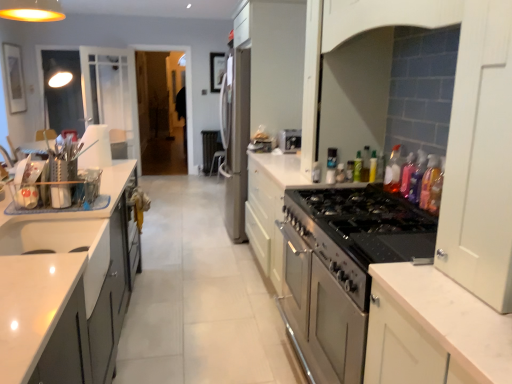
Question: Which direction should I rotate to face satin silver toaster at center, positioned as the second appliance in back-to-front order, — up or down?

Choices:
 (A) down
 (B) up

Answer: (B)

Question: From the image's perspective, would you say satin silver refrigerator at center, arranged as the 3th appliance when viewed from the front, is positioned over white glossy sink at lower left?

Choices:
 (A) yes
 (B) no

Answer: (A)

Question: Is satin silver refrigerator at center, the first appliance in the back-to-front sequence, completely or partially outside of white glossy sink at lower left?

Choices:
 (A) yes
 (B) no

Answer: (A)

Question: Is the position of satin silver refrigerator at center, arranged as the first appliance when viewed from the left, less distant than that of white glossy sink at lower left?

Choices:
 (A) yes
 (B) no

Answer: (B)

Question: From a real-world perspective, is satin silver refrigerator at center, positioned as the third appliance in right-to-left order, located beneath white glossy sink at lower left?

Choices:
 (A) yes
 (B) no

Answer: (B)

Question: Is there a large distance between satin silver refrigerator at center, arranged as the first appliance when viewed from the left, and white glossy sink at lower left?

Choices:
 (A) yes
 (B) no

Answer: (A)

Question: Is satin silver refrigerator at center, the third appliance when ordered from bottom to top, positioned behind white glossy sink at lower left?

Choices:
 (A) yes
 (B) no

Answer: (A)

Question: Is translucent plastic bottle at upper right, the fifth bottle viewed from the front, far from pink glossy bottle at upper right, the 5th bottle when ordered from back to front?

Choices:
 (A) no
 (B) yes

Answer: (A)

Question: Does translucent plastic bottle at upper right, the fifth bottle viewed from the front, come in front of pink glossy bottle at upper right, the 5th bottle when ordered from back to front?

Choices:
 (A) yes
 (B) no

Answer: (B)

Question: Is translucent plastic bottle at upper right, the fifth bottle viewed from the front, in contact with pink glossy bottle at upper right, the 3th bottle from the front?

Choices:
 (A) no
 (B) yes

Answer: (A)

Question: From a real-world perspective, is translucent plastic bottle at upper right, the fifth bottle viewed from the front, physically above pink glossy bottle at upper right, the 3th bottle from the front?

Choices:
 (A) yes
 (B) no

Answer: (B)

Question: Is pink glossy bottle at upper right, the 3th bottle from the front, inside translucent plastic bottle at upper right, which appears as the 3th bottle when viewed from the back?

Choices:
 (A) yes
 (B) no

Answer: (B)

Question: Does translucent plastic bottle at upper right, which appears as the 3th bottle when viewed from the back, have a greater width compared to pink glossy bottle at upper right, the 3th bottle from the front?

Choices:
 (A) no
 (B) yes

Answer: (A)

Question: Could you tell me if green glass bottle at upper right, acting as the second bottle starting from the back, is turned towards translucent plastic bottle at stove top, the 4th bottle from the back?

Choices:
 (A) yes
 (B) no

Answer: (B)